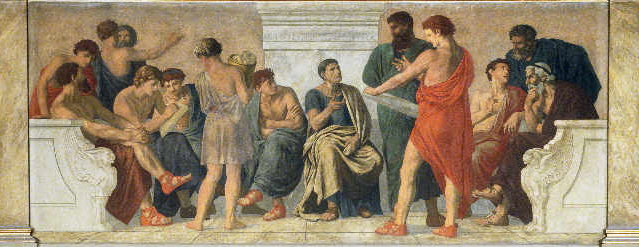
You are a GUI agent. You are given a task and a screenshot of the screen. Output one action in this format:
    pyautogui.click(x=<x>, y=<y>)
    Task: Click on the base of pillar
    The width and height of the screenshot is (639, 247).
    Given the screenshot: What is the action you would take?
    pyautogui.click(x=624, y=238), pyautogui.click(x=12, y=236)